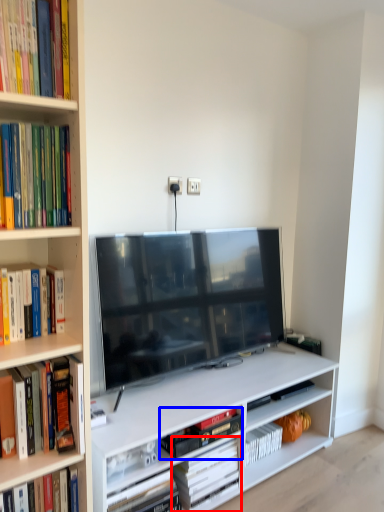
Question: Which object is further to the camera taking this photo, book (highlighted by a red box) or book (highlighted by a blue box)?

Choices:
 (A) book
 (B) book

Answer: (A)